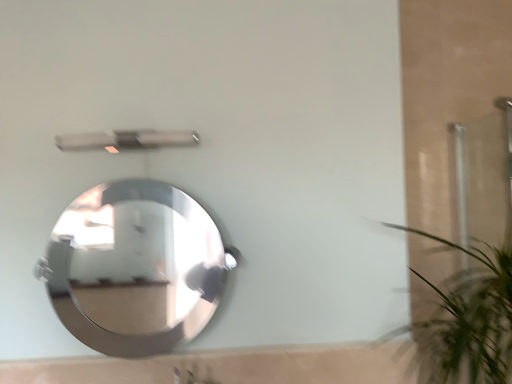
Question: Does metallic silver shower at upper center have a greater width compared to polished silver mirror at center?

Choices:
 (A) no
 (B) yes

Answer: (A)

Question: Can you confirm if metallic silver shower at upper center is shorter than polished silver mirror at center?

Choices:
 (A) no
 (B) yes

Answer: (B)

Question: Would you consider metallic silver shower at upper center to be distant from polished silver mirror at center?

Choices:
 (A) yes
 (B) no

Answer: (A)

Question: Is metallic silver shower at upper center looking in the opposite direction of polished silver mirror at center?

Choices:
 (A) no
 (B) yes

Answer: (A)

Question: Is polished silver mirror at center completely or partially inside metallic silver shower at upper center?

Choices:
 (A) no
 (B) yes

Answer: (A)

Question: Based on their positions, is polished silver mirror at center located to the left or right of green leafy plant at right?

Choices:
 (A) right
 (B) left

Answer: (B)

Question: Considering the positions of point (82, 299) and point (439, 350), is point (82, 299) closer or farther from the camera than point (439, 350)?

Choices:
 (A) closer
 (B) farther

Answer: (B)

Question: Is polished silver mirror at center inside the boundaries of green leafy plant at right, or outside?

Choices:
 (A) inside
 (B) outside

Answer: (B)

Question: Looking at their shapes, would you say polished silver mirror at center is wider or thinner than green leafy plant at right?

Choices:
 (A) wide
 (B) thin

Answer: (B)

Question: From the image's perspective, is green leafy plant at right above or below metallic silver shower at upper center?

Choices:
 (A) above
 (B) below

Answer: (B)

Question: Does point (482, 264) appear closer or farther from the camera than point (76, 142)?

Choices:
 (A) closer
 (B) farther

Answer: (B)

Question: In terms of width, does green leafy plant at right look wider or thinner when compared to metallic silver shower at upper center?

Choices:
 (A) wide
 (B) thin

Answer: (A)

Question: Considering the positions of green leafy plant at right and metallic silver shower at upper center in the image, is green leafy plant at right taller or shorter than metallic silver shower at upper center?

Choices:
 (A) short
 (B) tall

Answer: (B)

Question: In terms of height, does green leafy plant at right look taller or shorter compared to polished silver mirror at center?

Choices:
 (A) short
 (B) tall

Answer: (B)

Question: Considering their positions, is green leafy plant at right located in front of or behind polished silver mirror at center?

Choices:
 (A) behind
 (B) front

Answer: (B)